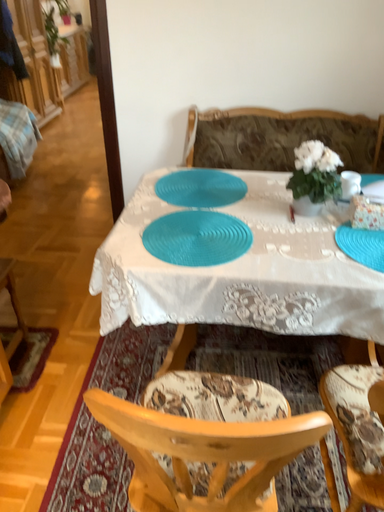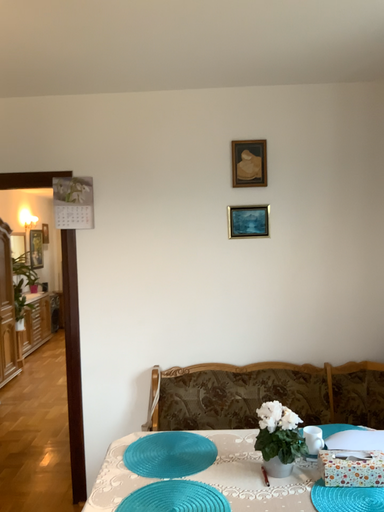
Question: Which way did the camera rotate in the video?

Choices:
 (A) rotated downward
 (B) rotated upward

Answer: (B)